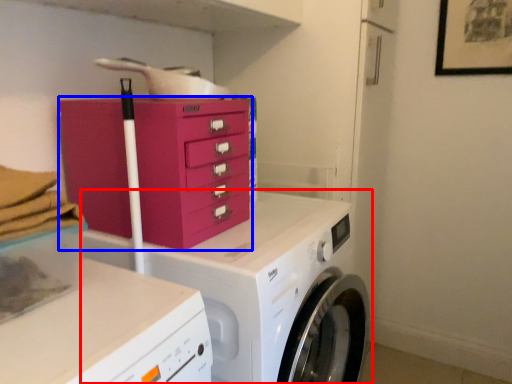
Question: Which of the following is the farthest to the observer, washing machine (highlighted by a red box) or chest of drawers (highlighted by a blue box)?

Choices:
 (A) washing machine
 (B) chest of drawers

Answer: (B)